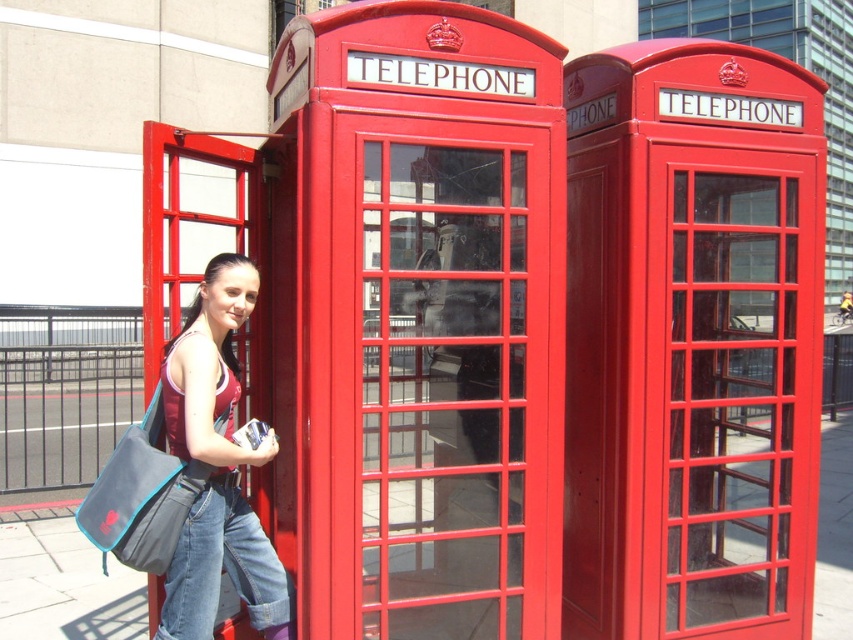
Question: Where is matte red telephone at center located in relation to metallic red telephone booth at right in the image?

Choices:
 (A) below
 (B) above

Answer: (B)

Question: Does metallic red telephone booth at right appear on the left side of matte fabric tank top at center?

Choices:
 (A) yes
 (B) no

Answer: (B)

Question: Which is nearer to the matte fabric tank top at center?

Choices:
 (A) metallic red telephone booth at right
 (B) matte red telephone at center

Answer: (B)

Question: Among these objects, which one is nearest to the camera?

Choices:
 (A) matte fabric tank top at center
 (B) metallic red telephone booth at right

Answer: (A)

Question: Which is farther from the matte red telephone at center?

Choices:
 (A) metallic red telephone booth at right
 (B) matte fabric tank top at center

Answer: (A)

Question: Considering the relative positions of metallic red telephone booth at right and matte fabric tank top at center in the image provided, where is metallic red telephone booth at right located with respect to matte fabric tank top at center?

Choices:
 (A) above
 (B) below

Answer: (A)